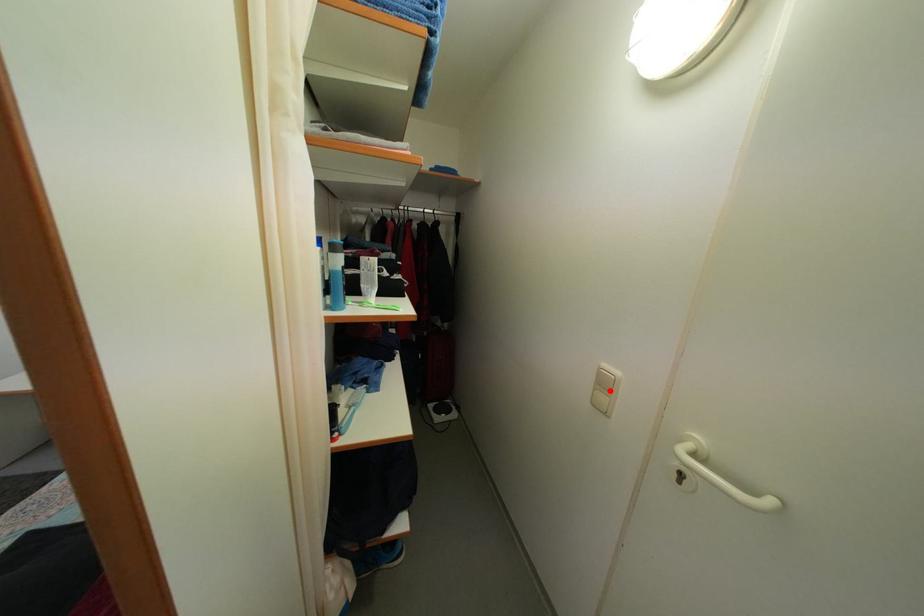
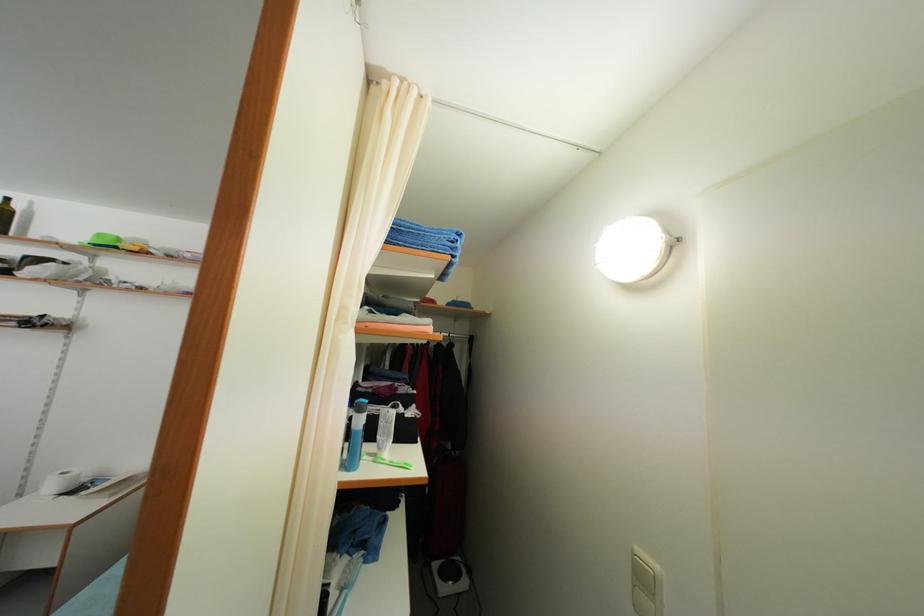
Locate, in the second image, the point that corresponds to the highlighted location in the first image.

(649, 586)